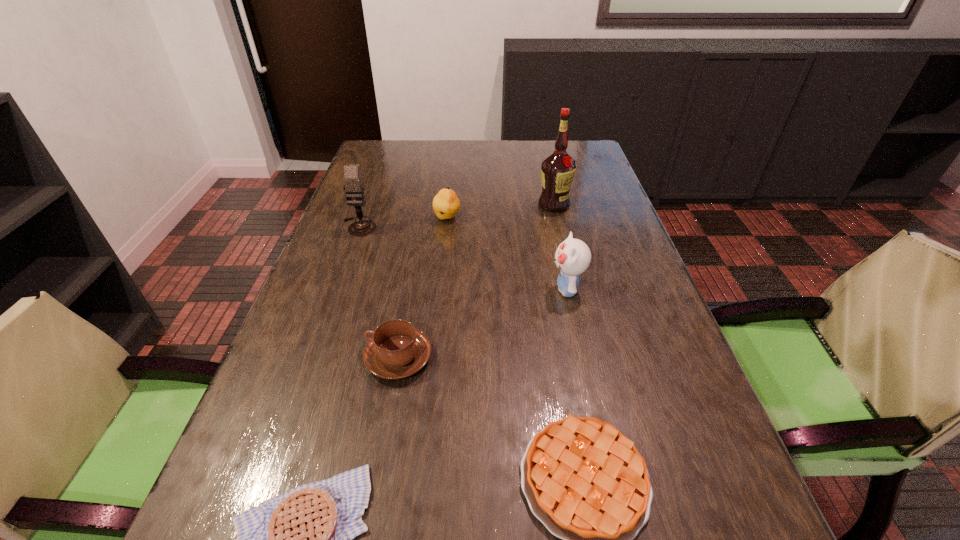
Image resolution: width=960 pixels, height=540 pixels. In the image, there is a desktop. Find the location of `vacant space at the left edge`. vacant space at the left edge is located at coordinates (354, 262).

I want to click on vacant space at the right edge of the desktop, so click(x=618, y=263).

In order to click on free region at the far right corner of the desktop in this screenshot , I will do `click(580, 148)`.

In order to click on vacant space that is in between the pear and the fifth tallest object in this screenshot , I will do `click(422, 288)`.

The height and width of the screenshot is (540, 960). I want to click on empty space between the tallest object and the pear, so click(x=500, y=211).

Where is `vacant point located between the pear and the microphone`? The height and width of the screenshot is (540, 960). vacant point located between the pear and the microphone is located at coordinates (403, 222).

You are a GUI agent. You are given a task and a screenshot of the screen. Output one action in this format:
    pyautogui.click(x=<x>, y=<y>)
    Task: Click on the vacant region between the third nearest object and the pear
    
    Given the screenshot: What is the action you would take?
    pyautogui.click(x=422, y=288)

Identify the location of free space between the fifth farthest object and the fourth tallest object. The image size is (960, 540). (422, 288).

In order to click on the sixth closest object to the microphone in this screenshot , I will do `click(585, 481)`.

Identify which object is located as the nearest to the second tallest object. Please provide its 2D coordinates. Your answer should be formatted as a tuple, i.e. [(x, y)], where the tuple contains the x and y coordinates of a point satisfying the conditions above.

[(446, 204)]